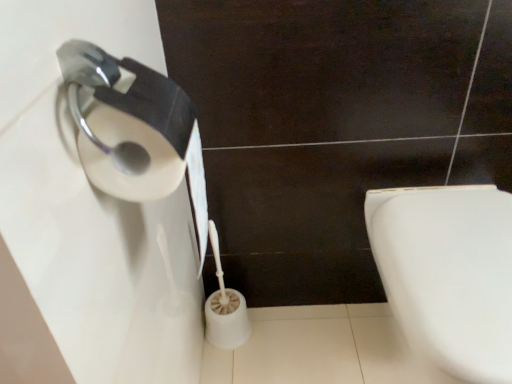
Question: Is white glossy toilet at lower right positioned behind white matte toilet paper at lower center?

Choices:
 (A) no
 (B) yes

Answer: (A)

Question: Does white glossy toilet at lower right turn towards white matte toilet paper at lower center?

Choices:
 (A) no
 (B) yes

Answer: (A)

Question: From a real-world perspective, is white glossy toilet at lower right below white matte toilet paper at lower center?

Choices:
 (A) yes
 (B) no

Answer: (B)

Question: Is white matte toilet paper at lower center located within white glossy toilet at lower right?

Choices:
 (A) yes
 (B) no

Answer: (B)

Question: From a real-world perspective, is white glossy toilet at lower right physically above white matte toilet paper at lower center?

Choices:
 (A) yes
 (B) no

Answer: (A)

Question: Can you confirm if white glossy toilet at lower right is wider than white matte toilet paper at lower center?

Choices:
 (A) no
 (B) yes

Answer: (B)

Question: Considering the relative positions of white matte toilet paper at lower center and white glossy toilet at lower right in the image provided, is white matte toilet paper at lower center behind white glossy toilet at lower right?

Choices:
 (A) no
 (B) yes

Answer: (B)

Question: Does white matte toilet paper at lower center have a lesser height compared to white glossy toilet at lower right?

Choices:
 (A) yes
 (B) no

Answer: (B)

Question: From a real-world perspective, is white matte toilet paper at lower center located beneath white glossy toilet at lower right?

Choices:
 (A) no
 (B) yes

Answer: (B)

Question: Can you see white matte toilet paper at lower center touching white glossy toilet at lower right?

Choices:
 (A) yes
 (B) no

Answer: (B)

Question: Is white matte toilet paper at lower center oriented towards white glossy toilet at lower right?

Choices:
 (A) yes
 (B) no

Answer: (B)

Question: Is white matte toilet paper at lower center positioned far away from white glossy toilet at lower right?

Choices:
 (A) no
 (B) yes

Answer: (A)

Question: From the image's perspective, relative to white matte toilet paper at lower center, is white glossy toilet at lower right above or below?

Choices:
 (A) above
 (B) below

Answer: (B)